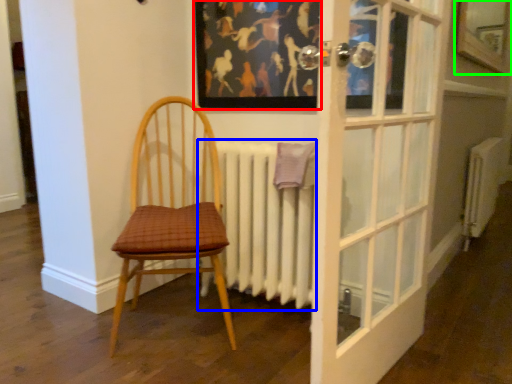
Question: Based on their relative distances, which object is nearer to picture frame (highlighted by a red box)? Choose from radiator (highlighted by a blue box) and window (highlighted by a green box).

Choices:
 (A) radiator
 (B) window

Answer: (A)